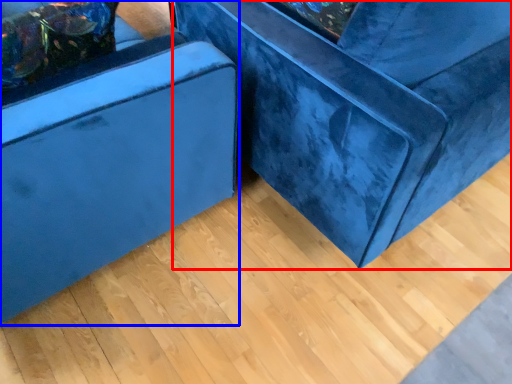
Question: Which object appears farthest to the camera in this image, furniture (highlighted by a red box) or furniture (highlighted by a blue box)?

Choices:
 (A) furniture
 (B) furniture

Answer: (A)